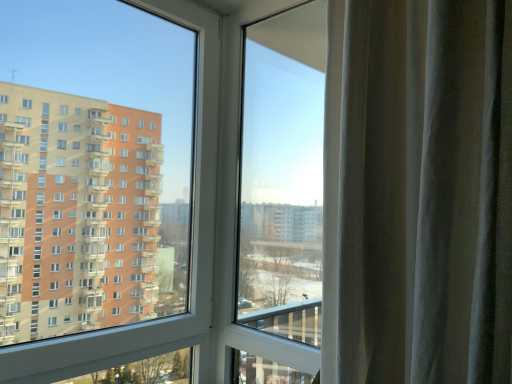
Describe the element at coordinates (112, 202) in the screenshot. I see `transparent glass window at center` at that location.

Identify the location of transparent glass window at center. This screenshot has height=384, width=512. (112, 202).

You are a GUI agent. You are given a task and a screenshot of the screen. Output one action in this format:
    pyautogui.click(x=<x>, y=<y>)
    Task: Click on the transparent glass window at center
    
    Given the screenshot: What is the action you would take?
    pyautogui.click(x=112, y=202)